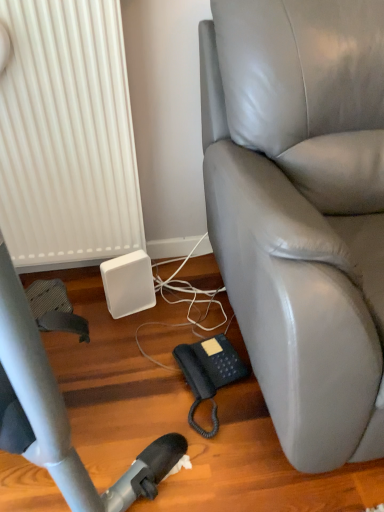
This screenshot has width=384, height=512. I want to click on vacant space in front of white matte speaker at lower left, so click(125, 344).